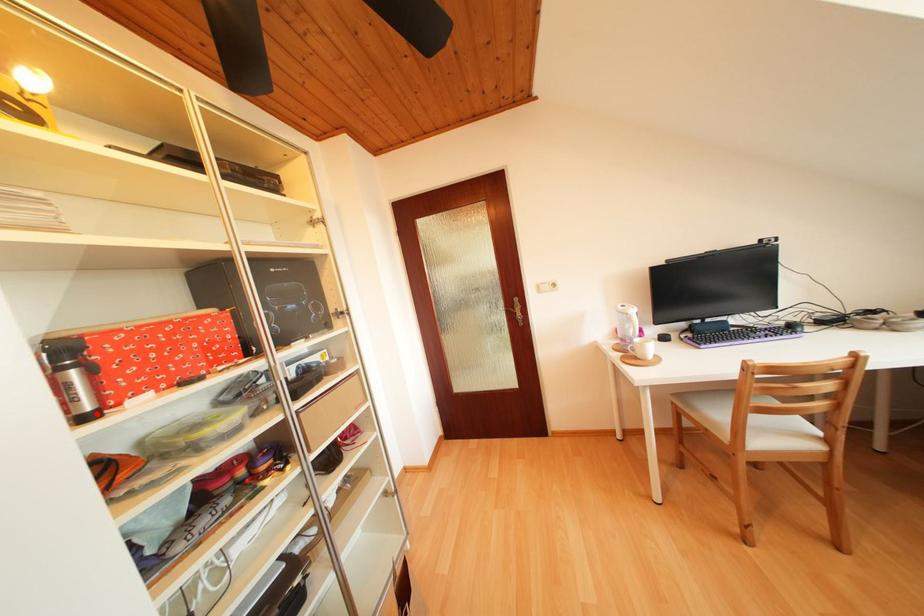
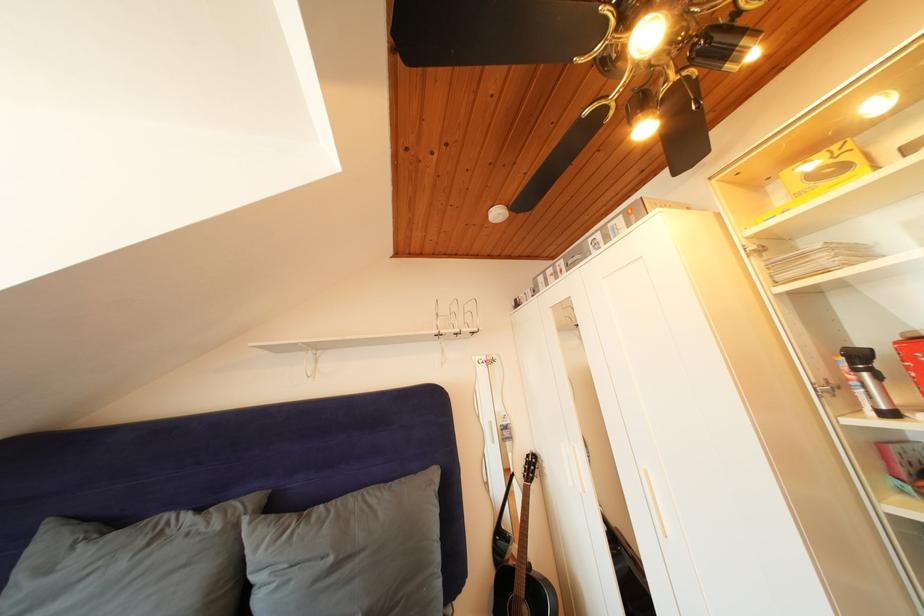
In the second image, find the point that corresponds to the highlighted location in the first image.

(892, 411)